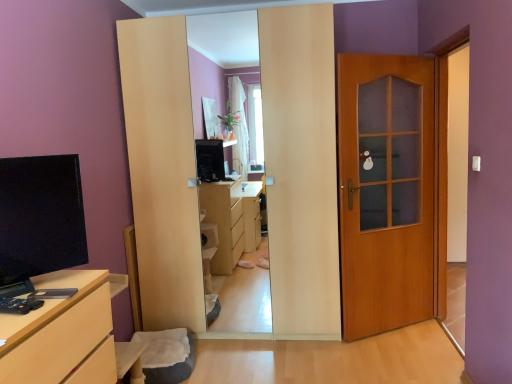
Question: Is matte black tv at left to the right of wooden door at right from the viewer's perspective?

Choices:
 (A) no
 (B) yes

Answer: (A)

Question: Are matte black tv at left and wooden door at right beside each other?

Choices:
 (A) yes
 (B) no

Answer: (B)

Question: Considering the relative sizes of matte black tv at left and wooden door at right in the image provided, is matte black tv at left bigger than wooden door at right?

Choices:
 (A) no
 (B) yes

Answer: (A)

Question: From the image's perspective, is matte black tv at left on wooden door at right?

Choices:
 (A) yes
 (B) no

Answer: (B)

Question: Is wooden door at right completely or partially inside matte black tv at left?

Choices:
 (A) yes
 (B) no

Answer: (B)

Question: Could you tell me if matte black tv at left is turned towards wooden door at right?

Choices:
 (A) no
 (B) yes

Answer: (A)

Question: Does matte black tv at left have a lesser height compared to matte wood chest of drawers at lower left?

Choices:
 (A) yes
 (B) no

Answer: (A)

Question: From a real-world perspective, is matte black tv at left positioned under matte wood chest of drawers at lower left based on gravity?

Choices:
 (A) no
 (B) yes

Answer: (A)

Question: Does matte black tv at left touch matte wood chest of drawers at lower left?

Choices:
 (A) yes
 (B) no

Answer: (B)

Question: Can you confirm if matte black tv at left is bigger than matte wood chest of drawers at lower left?

Choices:
 (A) yes
 (B) no

Answer: (B)

Question: Is matte black tv at left further to camera compared to matte wood chest of drawers at lower left?

Choices:
 (A) no
 (B) yes

Answer: (B)

Question: Considering the relative sizes of matte black tv at left and matte wood chest of drawers at lower left in the image provided, is matte black tv at left wider than matte wood chest of drawers at lower left?

Choices:
 (A) yes
 (B) no

Answer: (B)

Question: From the image's perspective, is wooden door at right beneath matte black tv at left?

Choices:
 (A) yes
 (B) no

Answer: (B)